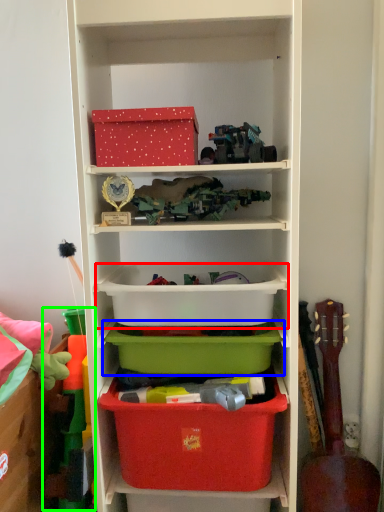
Question: Based on their relative distances, which object is farther from storage box (highlighted by a red box)? Choose from storage box (highlighted by a blue box) and toy (highlighted by a green box).

Choices:
 (A) storage box
 (B) toy

Answer: (B)